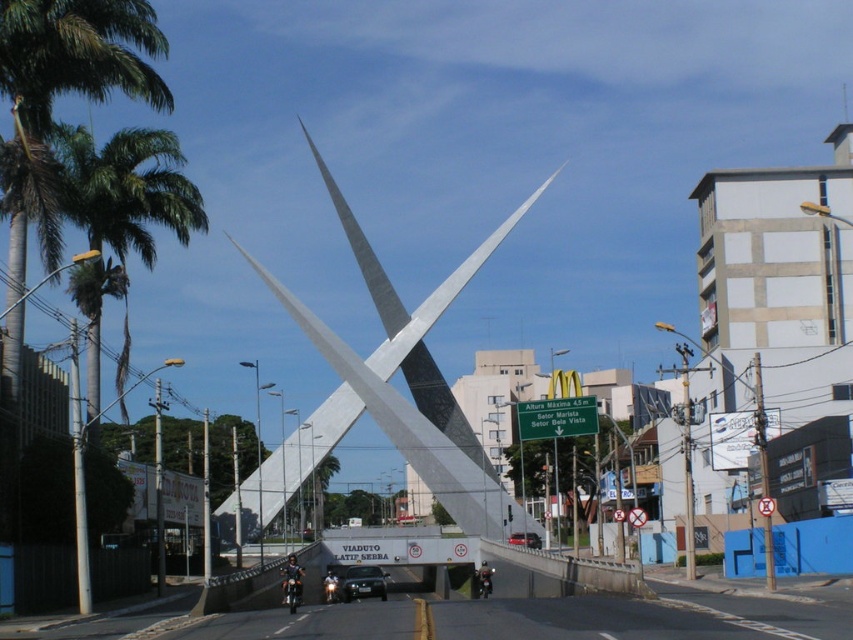
You are a photographer wanting to capture the silver polished steel sculpture at center without any vehicles in the frame. You see a metallic silver car at center in the image. Can you position yourself so that the car is hidden behind the sculpture? Explain how.

Yes, since the metallic silver car at center is behind the silver polished steel sculpture at center, you can position yourself in front of the sculpture so that the car is obscured by it.

You are a photographer standing at the base of the silver polished steel sculpture at center. You want to take a photo of the black metallic car at center without the sculpture blocking the view. Is this possible given their positions?

The silver polished steel sculpture at center is further to the viewer than the black metallic car at center, so the sculpture is closer to you. Therefore, you cannot take a photo of the black metallic car at center without the sculpture blocking the view.

You are a delivery driver who needs to pass through the area under the sculpture. The road is narrow, and your truck requires a minimum clearance of 12 feet to safely pass. Can you determine if there is enough space between the black metallic car at center and the metallic silver car at center for your truck to pass through?

The distance between the black metallic car at center and the metallic silver car at center is 75.72 feet, which is more than enough for your truck requiring 12 feet clearance to pass safely.